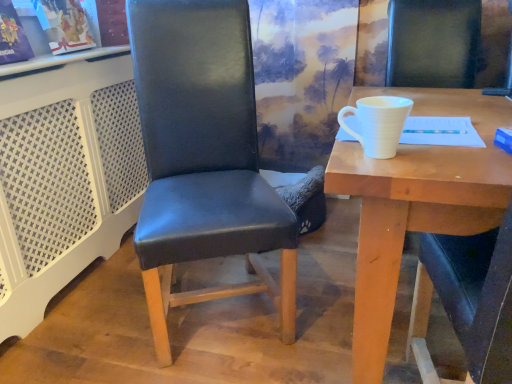
Question: Based on their positions, is black leather chair at center located to the left or right of white matte cup at right?

Choices:
 (A) right
 (B) left

Answer: (B)

Question: Based on their sizes in the image, would you say black leather chair at center is bigger or smaller than white matte cup at right?

Choices:
 (A) small
 (B) big

Answer: (B)

Question: Which is farther from the black leather chair at center?

Choices:
 (A) white matte cup at upper right
 (B) white matte cup at right

Answer: (B)

Question: Estimate the real-world distances between objects in this image. Which object is closer to the white matte cup at right?

Choices:
 (A) white matte cup at upper right
 (B) black leather chair at center

Answer: (A)